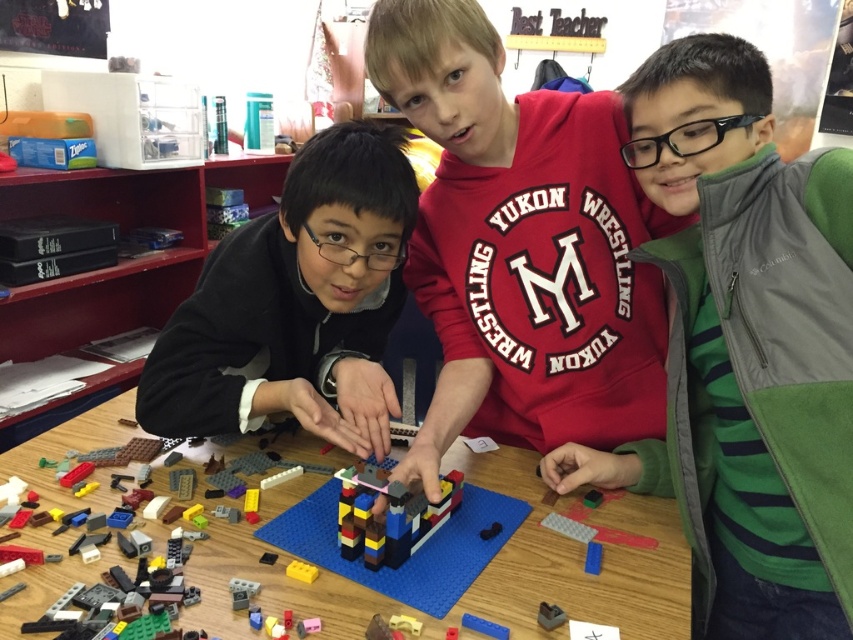
Question: Among these points, which one is nearest to the camera?

Choices:
 (A) (300, 563)
 (B) (200, 371)
 (C) (473, 627)

Answer: (C)

Question: Among these objects, which one is farthest from the camera?

Choices:
 (A) black matte hoodie at left
 (B) green fleece vest at center
 (C) yellow matte block at center
 (D) blue plastic brick at center

Answer: (A)

Question: Does wooden table at center lie behind smooth plastic brick at center?

Choices:
 (A) no
 (B) yes

Answer: (A)

Question: Which of these objects is positioned closest to the wooden table at center?

Choices:
 (A) translucent plastic cube at center
 (B) blue plastic brick at center
 (C) smooth plastic brick at center
 (D) brick-like plastic construction at center

Answer: (D)

Question: Does wooden table at center appear on the right side of smooth plastic brick at center?

Choices:
 (A) yes
 (B) no

Answer: (B)

Question: Can you confirm if green fleece vest at center is bigger than black matte hoodie at left?

Choices:
 (A) yes
 (B) no

Answer: (A)